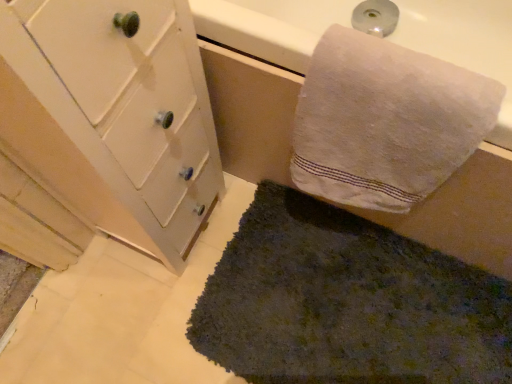
Find the location of `empty space that is in between white painted wood cabinet at left and dark green shaggy rug at lower center`. empty space that is in between white painted wood cabinet at left and dark green shaggy rug at lower center is located at coordinates (188, 265).